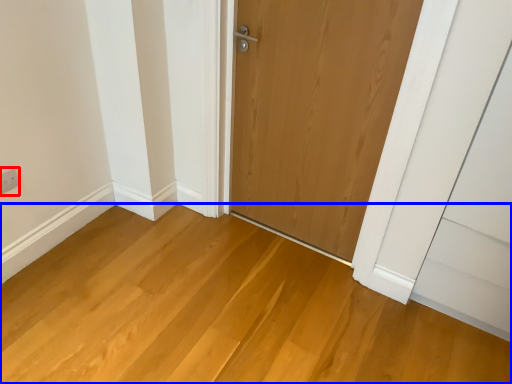
Question: Which object appears farthest to the camera in this image, electric outlet (highlighted by a red box) or plain (highlighted by a blue box)?

Choices:
 (A) electric outlet
 (B) plain

Answer: (A)